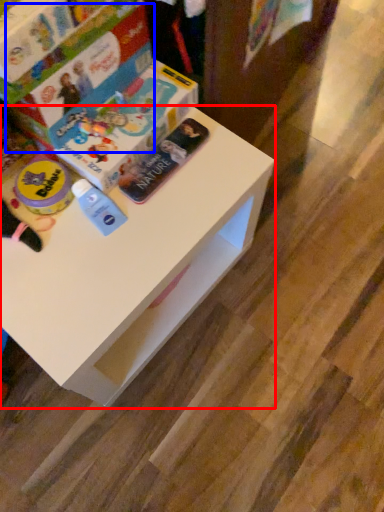
Question: Which object appears closest to the camera in this image, table (highlighted by a red box) or paperback book (highlighted by a blue box)?

Choices:
 (A) table
 (B) paperback book

Answer: (A)